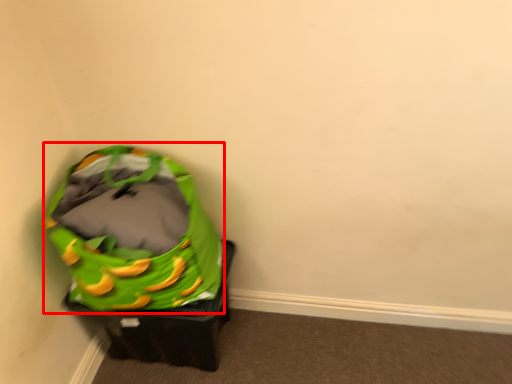
Question: Observing the image, what is the correct spatial positioning of bean bag chair (annotated by the red box) in reference to furniture?

Choices:
 (A) right
 (B) left

Answer: (B)